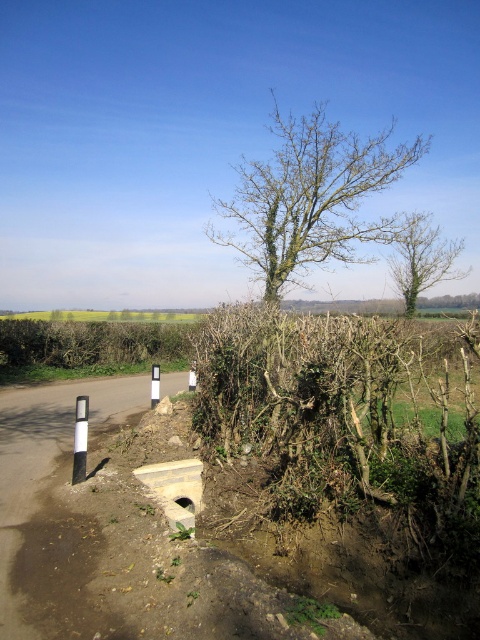
Question: Which point is closer to the camera?

Choices:
 (A) bare branches at center
 (B) bare branches at upper center
 (C) white plastic pole at left
 (D) white plastic pole at center

Answer: (C)

Question: Estimate the real-world distances between objects in this image. Which object is closer to the white plastic pole at center?

Choices:
 (A) bare branches at upper center
 (B) bare branches at center
 (C) white plastic pole at left

Answer: (C)

Question: Is green leafy hedge at center closer to the viewer compared to bare branches at upper center?

Choices:
 (A) no
 (B) yes

Answer: (B)

Question: Is white plastic pole at left further to the viewer compared to white plastic pole at center?

Choices:
 (A) yes
 (B) no

Answer: (B)

Question: Can you confirm if bare branches at center is positioned to the left of bare branches at upper center?

Choices:
 (A) yes
 (B) no

Answer: (A)

Question: Which is farther from the white plastic pole at left?

Choices:
 (A) white plastic pole at center
 (B) bare branches at center

Answer: (B)